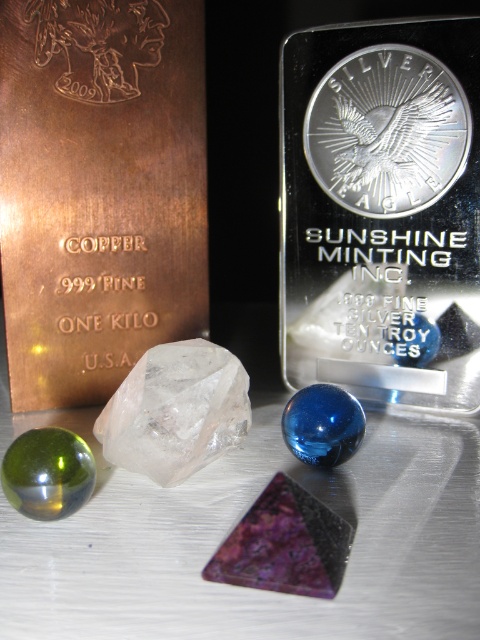
Which of these two, silver/metallic coin at center-right or green glass sphere at center, stands taller?

Standing taller between the two is silver/metallic coin at center-right.

Is silver/metallic coin at center-right taller than green glass sphere at center?

Correct, silver/metallic coin at center-right is much taller as green glass sphere at center.

Who is more forward, (372, 152) or (64, 492)?

Point (64, 492) is more forward.

Identify the location of silver/metallic coin at center-right. This screenshot has height=640, width=480. (387, 131).